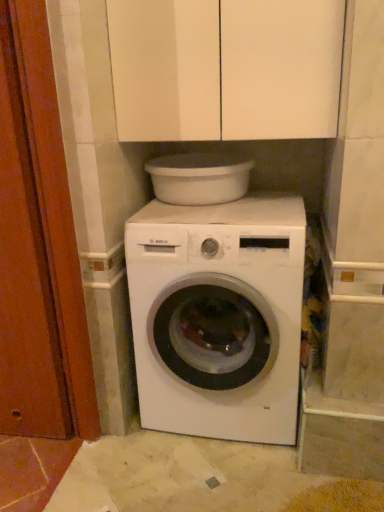
Question: Does white plastic basin at upper center appear on the left side of white matte cabinet at upper center?

Choices:
 (A) no
 (B) yes

Answer: (B)

Question: Is white plastic basin at upper center outside of white matte cabinet at upper center?

Choices:
 (A) yes
 (B) no

Answer: (A)

Question: From a real-world perspective, is white plastic basin at upper center on white matte cabinet at upper center?

Choices:
 (A) yes
 (B) no

Answer: (B)

Question: Can you confirm if white plastic basin at upper center is thinner than white matte cabinet at upper center?

Choices:
 (A) no
 (B) yes

Answer: (B)

Question: From the image's perspective, is white plastic basin at upper center below white matte cabinet at upper center?

Choices:
 (A) yes
 (B) no

Answer: (A)

Question: Is white plastic basin at upper center taller than white matte cabinet at upper center?

Choices:
 (A) yes
 (B) no

Answer: (B)

Question: Does white plastic basin at upper center have a larger size compared to wooden door at left?

Choices:
 (A) no
 (B) yes

Answer: (A)

Question: Is white plastic basin at upper center facing towards wooden door at left?

Choices:
 (A) no
 (B) yes

Answer: (A)

Question: Considering the relative sizes of white plastic basin at upper center and wooden door at left in the image provided, is white plastic basin at upper center taller than wooden door at left?

Choices:
 (A) yes
 (B) no

Answer: (B)

Question: Considering the relative sizes of white plastic basin at upper center and wooden door at left in the image provided, is white plastic basin at upper center smaller than wooden door at left?

Choices:
 (A) no
 (B) yes

Answer: (B)

Question: Can you confirm if white plastic basin at upper center is positioned to the right of wooden door at left?

Choices:
 (A) yes
 (B) no

Answer: (A)

Question: Is white plastic basin at upper center positioned beyond the bounds of wooden door at left?

Choices:
 (A) no
 (B) yes

Answer: (B)

Question: Would you say wooden door at left is a long distance from white matte washing machine at center?

Choices:
 (A) yes
 (B) no

Answer: (B)